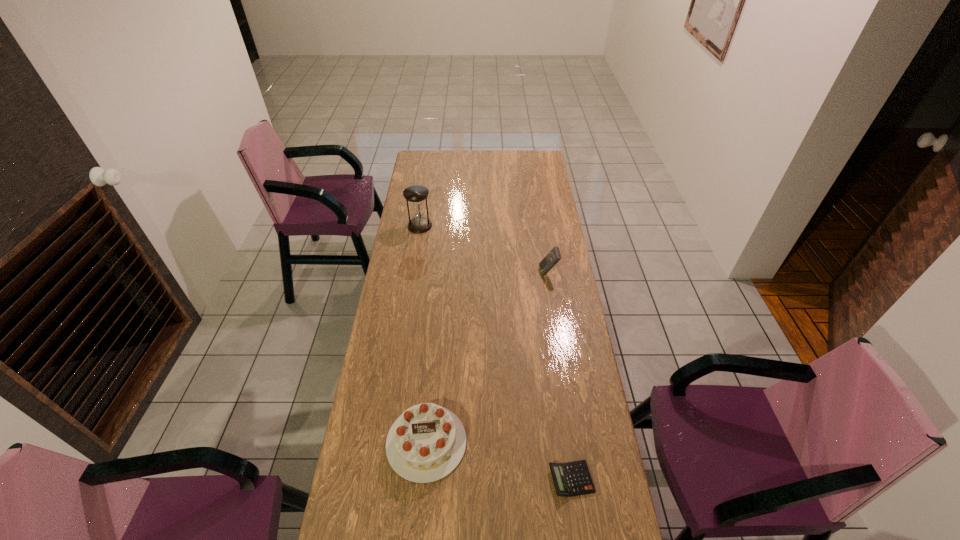
At what (x,y) coordinates should I click in order to perform the action: click on vacant space situated on the front-facing side of the farther calculator. Please return your answer as a coordinate pair (x, y). Looking at the image, I should click on (456, 272).

In order to click on blank space located on the front of the birthday cake in this screenshot , I will do `click(418, 538)`.

Where is `free space located 0.370m on the left of the shortest object`? The image size is (960, 540). free space located 0.370m on the left of the shortest object is located at coordinates (423, 480).

Find the location of `hourglass that is at the left edge`. hourglass that is at the left edge is located at coordinates (416, 194).

You are a GUI agent. You are given a task and a screenshot of the screen. Output one action in this format:
    pyautogui.click(x=<x>, y=<y>)
    Task: Click on the birthday cake located at the left edge
    The width and height of the screenshot is (960, 540).
    Given the screenshot: What is the action you would take?
    pyautogui.click(x=426, y=443)

The image size is (960, 540). What are the coordinates of `vacant space at the far edge of the desktop` in the screenshot? It's located at (500, 161).

Where is `free region at the left edge of the desktop`? The width and height of the screenshot is (960, 540). free region at the left edge of the desktop is located at coordinates (429, 254).

Find the location of `vacant space at the right edge of the desktop`. vacant space at the right edge of the desktop is located at coordinates (569, 511).

Identify the location of free space that is in between the hourglass and the farther calculator. The height and width of the screenshot is (540, 960). (484, 249).

Where is `unoccupied area between the farthest object and the shortest object`? unoccupied area between the farthest object and the shortest object is located at coordinates (495, 353).